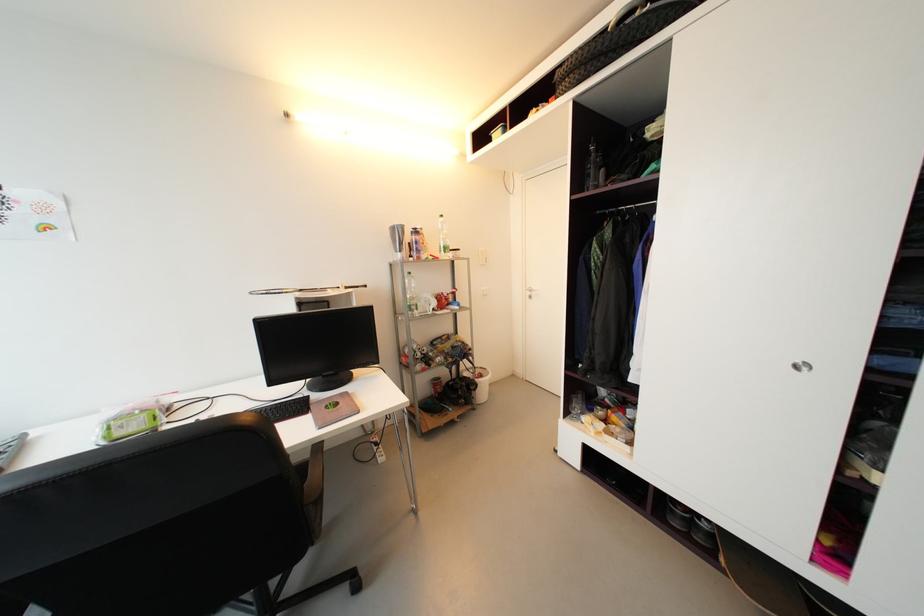
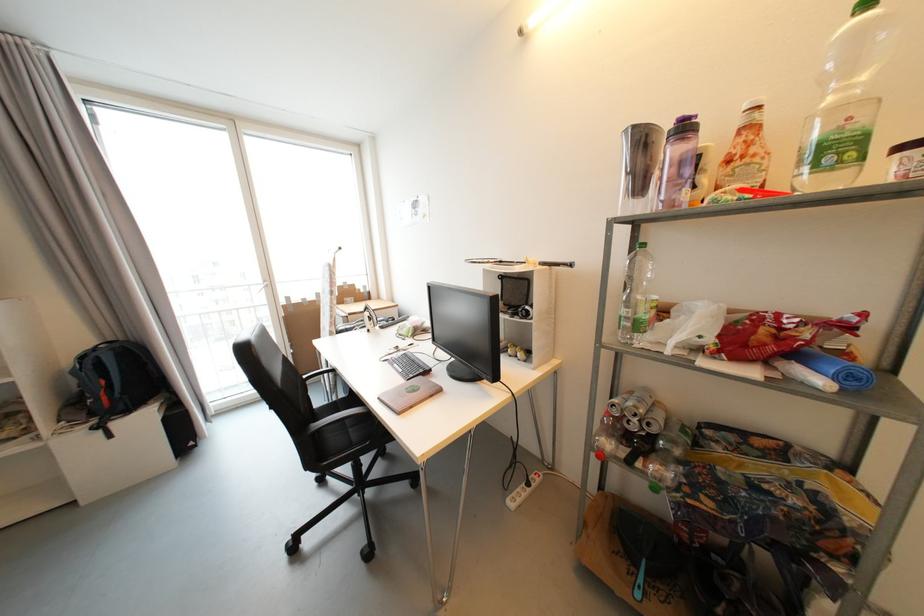
In the second image, find the point that corresponds to pixel 420 233 in the first image.

(689, 130)